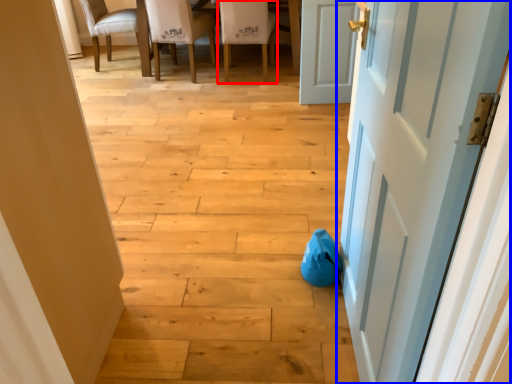
Question: Which object is further to the camera taking this photo, chair (highlighted by a red box) or door (highlighted by a blue box)?

Choices:
 (A) chair
 (B) door

Answer: (A)